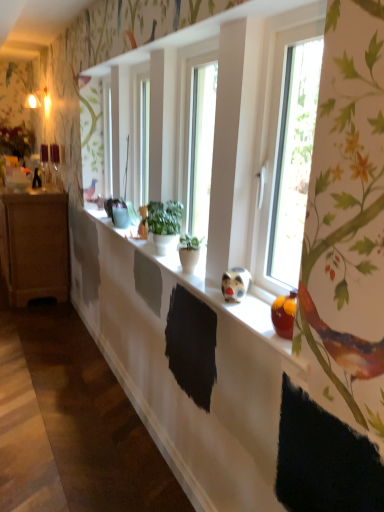
Question: Visually, is transparent glass window at right positioned to the left or to the right of green matte plant pot at center, positioned as the second houseplant in back-to-front order?

Choices:
 (A) right
 (B) left

Answer: (A)

Question: Looking at their shapes, would you say transparent glass window at right is wider or thinner than green matte plant pot at center, which is counted as the 1th houseplant, starting from the front?

Choices:
 (A) thin
 (B) wide

Answer: (B)

Question: Which is farther from the transparent glass window at right?

Choices:
 (A) green matte plant pot at center, which is counted as the 1th houseplant, starting from the front
 (B) matte brown cabinet at left
 (C) green matte plant at center, the first houseplant from the back
 (D) white matte window sill at center

Answer: (B)

Question: Estimate the real-world distances between objects in this image. Which object is farther from the matte brown cabinet at left?

Choices:
 (A) white matte window sill at center
 (B) green matte plant at center, placed as the second houseplant when sorted from front to back
 (C) transparent glass window at right
 (D) green matte plant pot at center, positioned as the second houseplant in back-to-front order

Answer: (C)